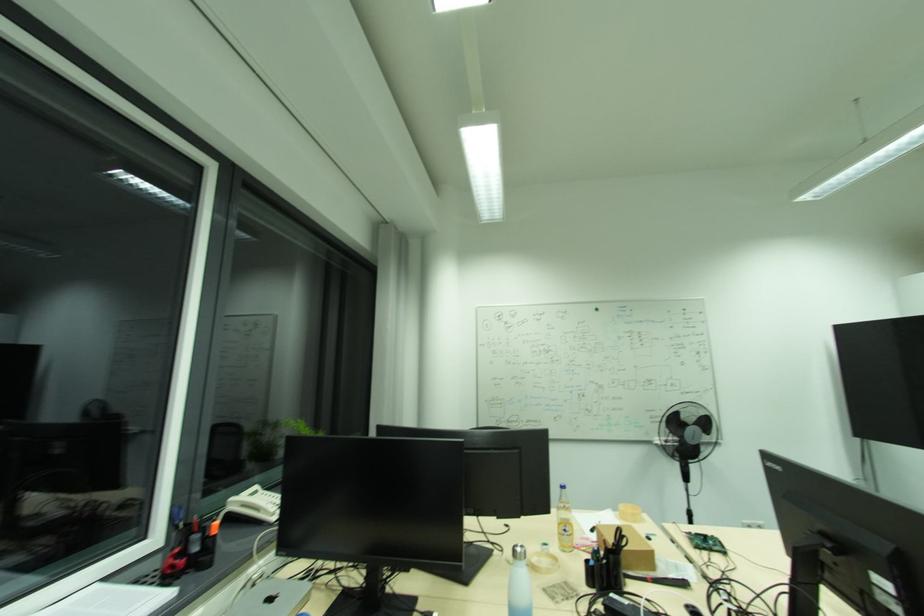
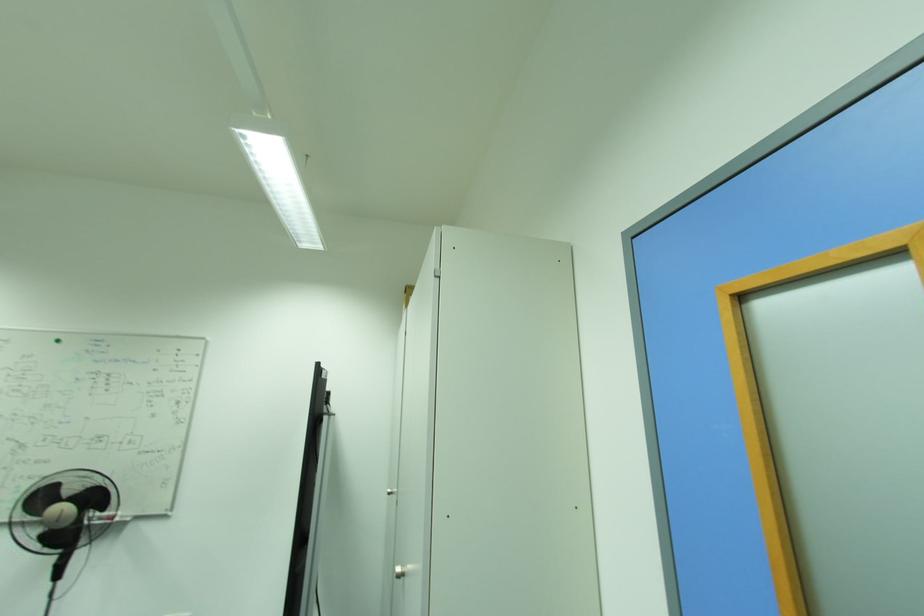
Question: What movement of the cameraman would produce the second image?

Choices:
 (A) Left
 (B) Right
 (C) Forward
 (D) Backward

Answer: (B)